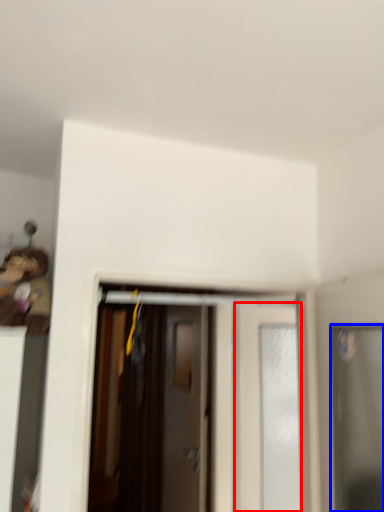
Question: Among these objects, which one is farthest to the camera, door (highlighted by a red box) or door (highlighted by a blue box)?

Choices:
 (A) door
 (B) door

Answer: (A)